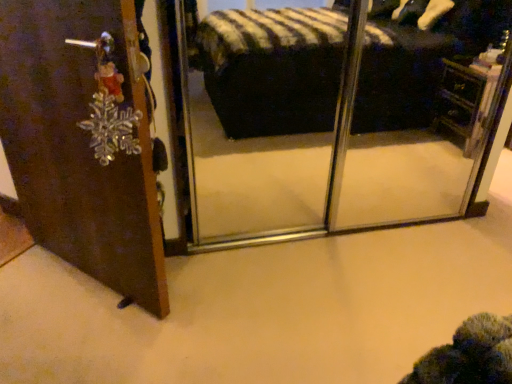
Question: Is wooden vanity at right shorter than brown wooden door at left?

Choices:
 (A) yes
 (B) no

Answer: (A)

Question: Is wooden vanity at right looking in the opposite direction of brown wooden door at left?

Choices:
 (A) yes
 (B) no

Answer: (B)

Question: Is wooden vanity at right far from brown wooden door at left?

Choices:
 (A) yes
 (B) no

Answer: (A)

Question: Considering the relative positions of wooden vanity at right and brown wooden door at left in the image provided, is wooden vanity at right to the left of brown wooden door at left from the viewer's perspective?

Choices:
 (A) yes
 (B) no

Answer: (B)

Question: From a real-world perspective, is wooden vanity at right positioned over brown wooden door at left based on gravity?

Choices:
 (A) no
 (B) yes

Answer: (A)

Question: From the image's perspective, does wooden vanity at right appear higher than brown wooden door at left?

Choices:
 (A) no
 (B) yes

Answer: (B)

Question: Considering the relative sizes of brown wooden door at left and wooden vanity at right in the image provided, is brown wooden door at left shorter than wooden vanity at right?

Choices:
 (A) yes
 (B) no

Answer: (B)

Question: Is brown wooden door at left far from wooden vanity at right?

Choices:
 (A) yes
 (B) no

Answer: (A)

Question: Considering the relative sizes of brown wooden door at left and wooden vanity at right in the image provided, is brown wooden door at left wider than wooden vanity at right?

Choices:
 (A) yes
 (B) no

Answer: (A)

Question: Does brown wooden door at left come behind wooden vanity at right?

Choices:
 (A) yes
 (B) no

Answer: (B)

Question: Are brown wooden door at left and wooden vanity at right making contact?

Choices:
 (A) yes
 (B) no

Answer: (B)

Question: Is brown wooden door at left outside wooden vanity at right?

Choices:
 (A) yes
 (B) no

Answer: (A)

Question: Considering the positions of brown wooden door at left and wooden vanity at right in the image, is brown wooden door at left taller or shorter than wooden vanity at right?

Choices:
 (A) tall
 (B) short

Answer: (A)